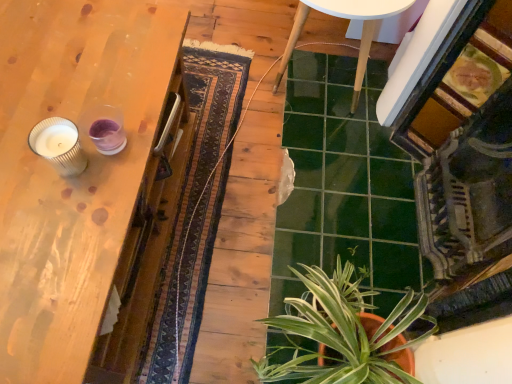
Image resolution: width=512 pixels, height=384 pixels. What are the coordinates of `free space in front of ridged glass candle at left` in the screenshot? It's located at (56, 226).